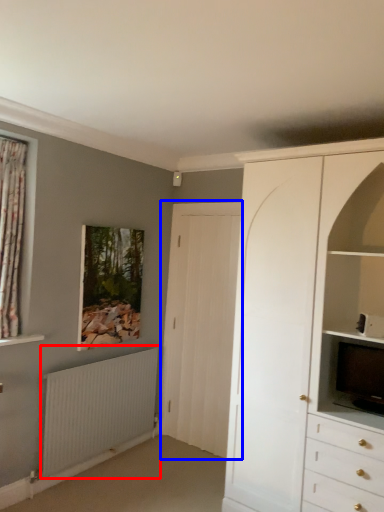
Question: Among these objects, which one is nearest to the camera, radiator (highlighted by a red box) or door (highlighted by a blue box)?

Choices:
 (A) radiator
 (B) door

Answer: (A)